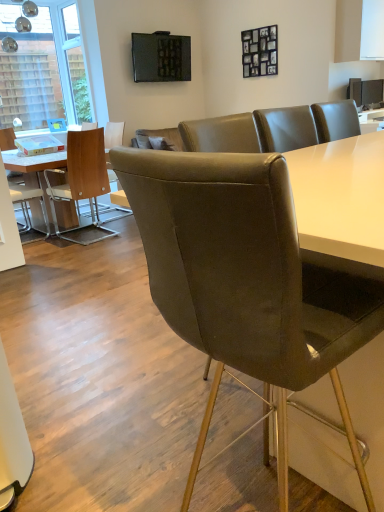
Question: Are white leather chair at left, the 1th chair when ordered from left to right, and matte black tv at upper center, positioned as the 1th television in left-to-right order, making contact?

Choices:
 (A) yes
 (B) no

Answer: (B)

Question: Considering the relative sizes of white leather chair at left, placed as the third chair when sorted from front to back, and matte black tv at upper center, the second television in the right-to-left sequence, in the image provided, is white leather chair at left, placed as the third chair when sorted from front to back, wider than matte black tv at upper center, the second television in the right-to-left sequence,?

Choices:
 (A) yes
 (B) no

Answer: (A)

Question: Can you confirm if white leather chair at left, placed as the first chair when sorted from back to front, is positioned to the left of matte black tv at upper center, positioned as the 1th television in left-to-right order?

Choices:
 (A) no
 (B) yes

Answer: (B)

Question: From a real-world perspective, is white leather chair at left, which ranks as the 3th chair in right-to-left order, over matte black tv at upper center, positioned as the 1th television in left-to-right order?

Choices:
 (A) no
 (B) yes

Answer: (A)

Question: Would you say white leather chair at left, the 1th chair when ordered from left to right, contains matte black tv at upper center, positioned as the 1th television in left-to-right order?

Choices:
 (A) yes
 (B) no

Answer: (B)

Question: Considering the positions of matte black tv at upper center, which is counted as the first television, starting from the top, and white leather chair at left, placed as the third chair when sorted from front to back, in the image, is matte black tv at upper center, which is counted as the first television, starting from the top, bigger or smaller than white leather chair at left, placed as the third chair when sorted from front to back,?

Choices:
 (A) big
 (B) small

Answer: (B)

Question: Do you think matte black tv at upper center, which is counted as the first television, starting from the top, is within white leather chair at left, placed as the third chair when sorted from front to back, or outside of it?

Choices:
 (A) inside
 (B) outside

Answer: (B)

Question: From the image's perspective, relative to white leather chair at left, the 1th chair when ordered from left to right, is matte black tv at upper center, which is counted as the first television, starting from the top, above or below?

Choices:
 (A) above
 (B) below

Answer: (A)

Question: Considering the positions of matte black tv at upper center, the second television from the bottom, and white leather chair at left, which ranks as the 3th chair in right-to-left order, in the image, is matte black tv at upper center, the second television from the bottom, wider or thinner than white leather chair at left, which ranks as the 3th chair in right-to-left order,?

Choices:
 (A) wide
 (B) thin

Answer: (B)

Question: Considering the positions of transparent glass window at upper left and matte brown chair at left, which appears as the 2th chair when viewed from the left, in the image, is transparent glass window at upper left taller or shorter than matte brown chair at left, which appears as the 2th chair when viewed from the left,?

Choices:
 (A) tall
 (B) short

Answer: (A)

Question: From a real-world perspective, is transparent glass window at upper left above or below matte brown chair at left, placed as the 2th chair when sorted from front to back?

Choices:
 (A) below
 (B) above

Answer: (B)

Question: Considering their positions, is transparent glass window at upper left located in front of or behind matte brown chair at left, which appears as the 2th chair when viewed from the left?

Choices:
 (A) front
 (B) behind

Answer: (B)

Question: Is point (89, 111) closer or farther from the camera than point (96, 134)?

Choices:
 (A) closer
 (B) farther

Answer: (B)

Question: Is white leather chair at left, placed as the third chair when sorted from front to back, to the left or to the right of brown leather chair at center, which is counted as the 3th chair, starting from the back, in the image?

Choices:
 (A) left
 (B) right

Answer: (A)

Question: From the image's perspective, is white leather chair at left, placed as the first chair when sorted from back to front, positioned above or below brown leather chair at center, the first chair in the front-to-back sequence?

Choices:
 (A) above
 (B) below

Answer: (A)